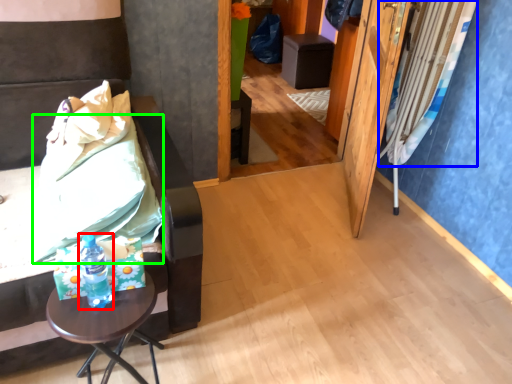
Question: Which object is positioned closest to bottle (highlighted by a red box)? Select from curtain (highlighted by a blue box) and sheet (highlighted by a green box).

Choices:
 (A) curtain
 (B) sheet

Answer: (B)